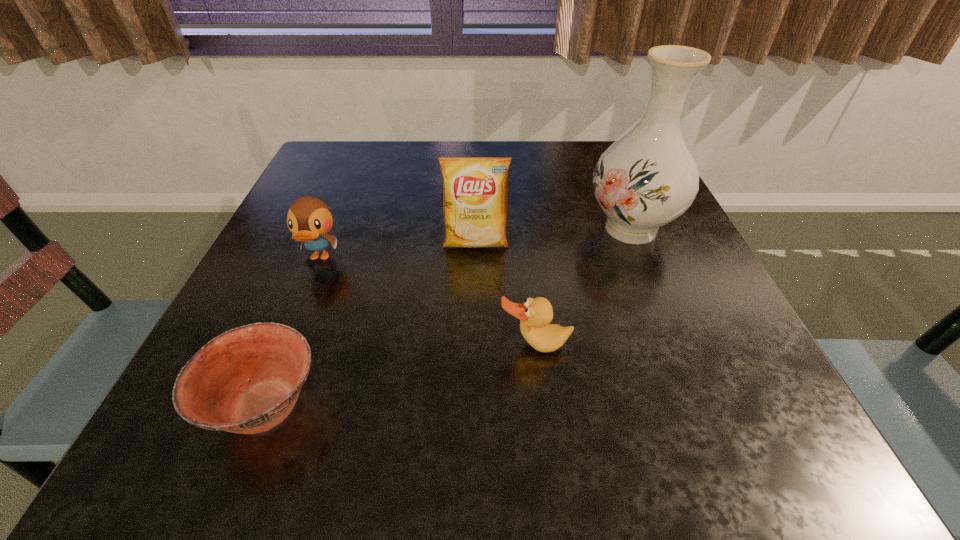
The height and width of the screenshot is (540, 960). I want to click on vacant area located 0.110m on the front-facing side of the taller duck, so click(294, 320).

Where is `blank space located on the beak of the second nearest object`? blank space located on the beak of the second nearest object is located at coordinates (547, 455).

At what (x,y) coordinates should I click in order to perform the action: click on vacant space situated 0.130m on the right of the bowl. Please return your answer as a coordinate pair (x, y). This screenshot has width=960, height=540. Looking at the image, I should click on (419, 406).

Find the location of a particular element. This screenshot has height=540, width=960. object located in the near edge section of the desktop is located at coordinates (247, 380).

You are a GUI agent. You are given a task and a screenshot of the screen. Output one action in this format:
    pyautogui.click(x=<x>, y=<y>)
    Task: Click on the duck positioned at the left edge
    
    Given the screenshot: What is the action you would take?
    pyautogui.click(x=309, y=219)

The image size is (960, 540). I want to click on bowl that is at the left edge, so click(247, 380).

The height and width of the screenshot is (540, 960). Identify the location of object situated at the right edge. (646, 179).

Find the location of `object that is positioned at the near left corner`. object that is positioned at the near left corner is located at coordinates [247, 380].

Identify the location of free space at the far edge of the desktop. The width and height of the screenshot is (960, 540). (559, 160).

In the image, there is a desktop. Where is `free region at the left edge`? The image size is (960, 540). free region at the left edge is located at coordinates (279, 284).